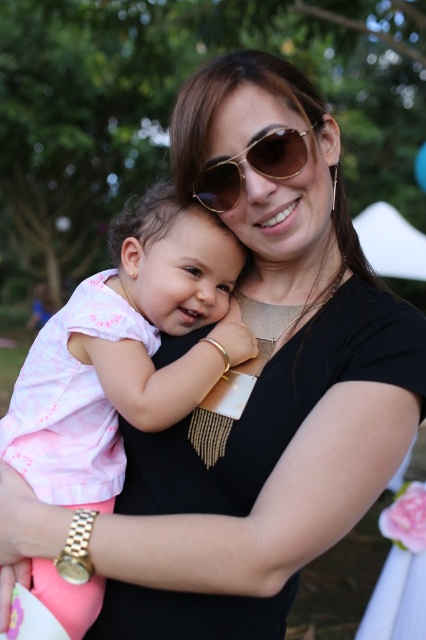
Is pink cotton shirt at center thinner than gold metallic sunglasses at center?

Incorrect, pink cotton shirt at center's width is not less than gold metallic sunglasses at center's.

Between point (242, 248) and point (255, 152), which one is positioned in front?

Point (255, 152) is more forward.

Does point (134, 326) lie in front of point (282, 156)?

No, it is not.

Locate an element on the screen. This screenshot has width=426, height=640. pink cotton shirt at center is located at coordinates (126, 349).